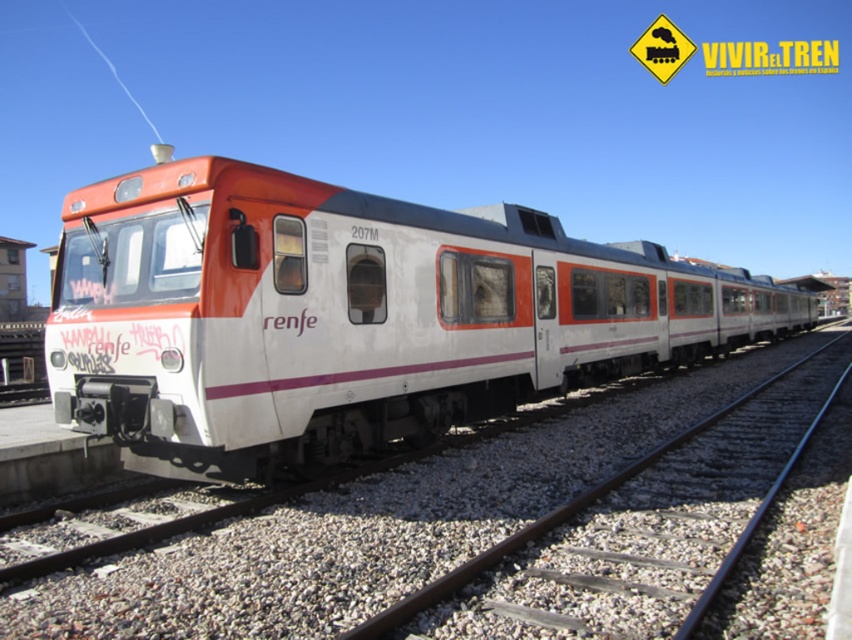
Which is behind, point (199, 243) or point (496, 634)?

The point (199, 243) is behind.

Is white matte train at center positioned in front of metal at center?

No, white matte train at center is further to the viewer.

Identify the location of white matte train at center. The height and width of the screenshot is (640, 852). (350, 316).